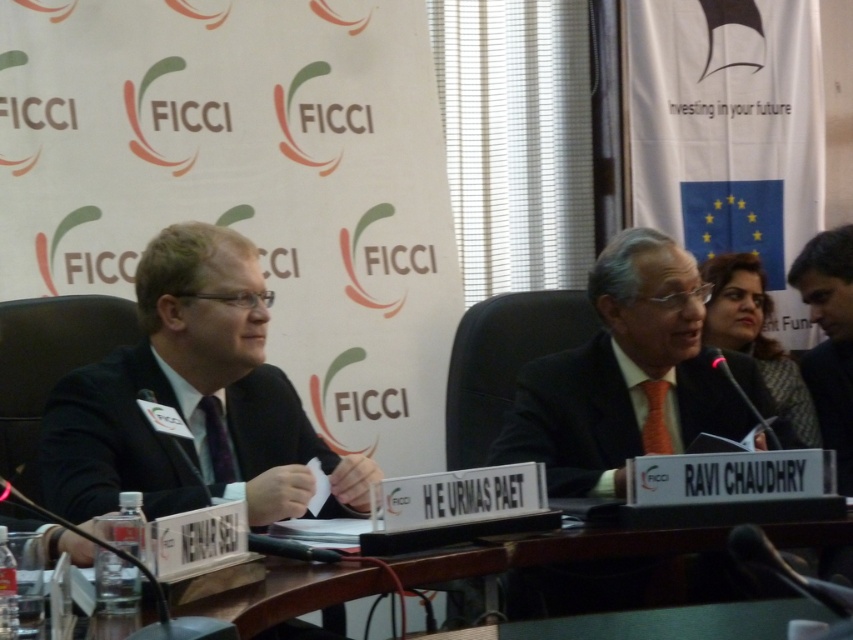
You are attending a FICCI conference and notice an orange silk tie at center and a black plastic table at lower center. Which object is closer to you?

The orange silk tie at center is closer to you because it is further to the viewer than the black plastic table at lower center.

You are organizing a meeting and need to place a laptop on the black plastic table at lower center. The laptop requires a minimum of 20 cm of space. Can the dark gray suit at right be moved to free up space on the table?

The black plastic table at lower center is smaller than the dark gray suit at right, so moving the dark gray suit at right might not be necessary as the table size is already smaller. However, without knowing the exact dimensions of the table, it is uncertain if there is enough space for the laptop.